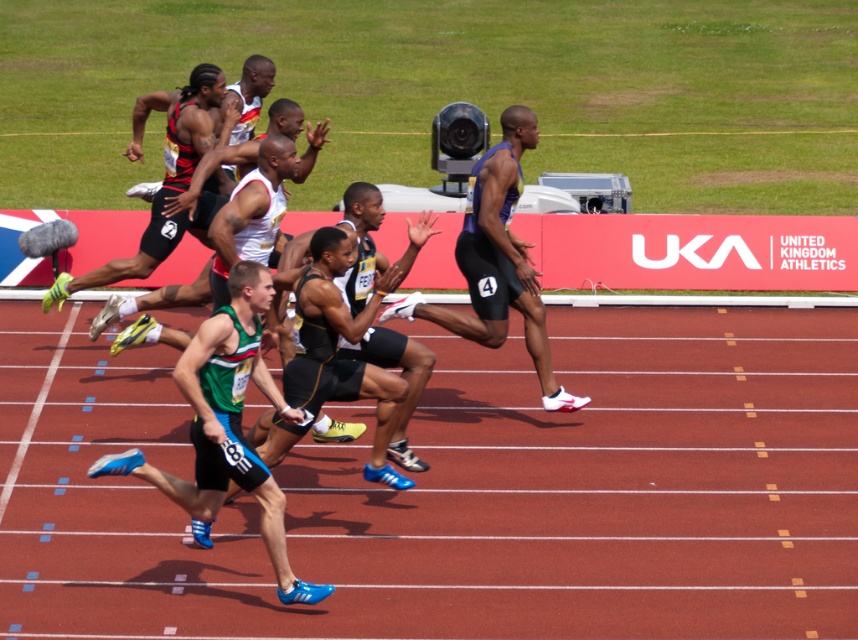
You are a photographer at the track and field event. You want to capture a closeup of the matte black shorts at center and the matte black shorts at left. Which pair of shorts should you zoom in more on to ensure they appear the same size in your photo?

The matte black shorts at center is smaller in size compared to the matte black shorts at left. To make them appear the same size in the photo, you should zoom in more on the matte black shorts at center since it is smaller and needs to be magnified to match the size of the matte black shorts at left.